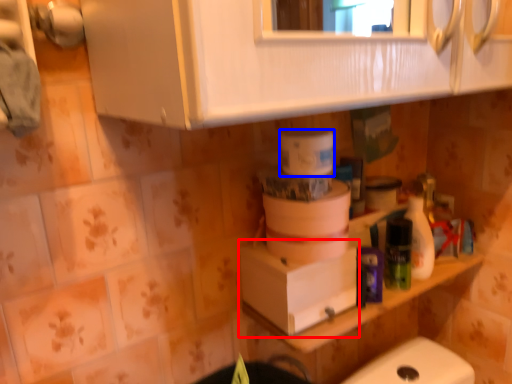
Question: Which of the following is the closest to the observer, cardboard box (highlighted by a red box) or toilet paper (highlighted by a blue box)?

Choices:
 (A) cardboard box
 (B) toilet paper

Answer: (B)